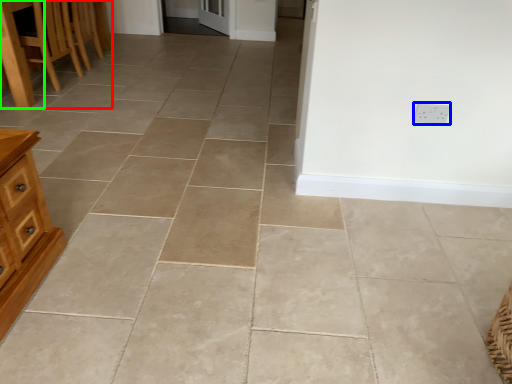
Question: Which is nearer to the furniture (highlighted by a red box)? electric outlet (highlighted by a blue box) or table (highlighted by a green box).

Choices:
 (A) electric outlet
 (B) table

Answer: (B)